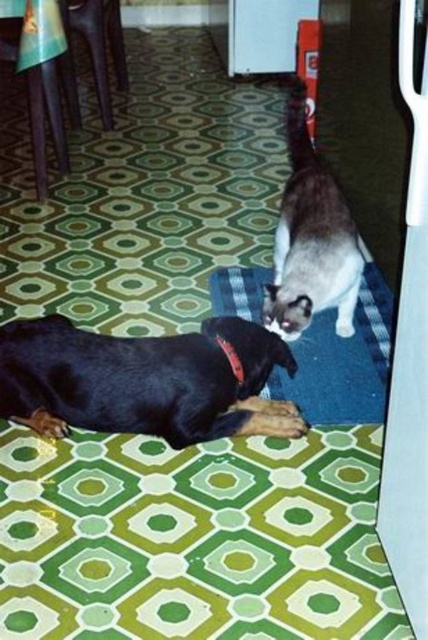
Question: Which point is farther to the camera?

Choices:
 (A) (193, 364)
 (B) (241, 371)
 (C) (327, 273)
 (D) (256, 268)

Answer: (D)

Question: Is black glossy dog at lower left smaller than white fur cat at upper center?

Choices:
 (A) yes
 (B) no

Answer: (A)

Question: Which of the following is the closest to the observer?

Choices:
 (A) black fabric neckband at lower center
 (B) blue carpet at center

Answer: (A)

Question: Considering the real-world distances, which object is farthest from the black glossy dog at lower left?

Choices:
 (A) black fabric neckband at lower center
 (B) blue carpet at center

Answer: (B)

Question: Does white fur cat at upper center appear over black fabric neckband at lower center?

Choices:
 (A) no
 (B) yes

Answer: (B)

Question: Does white fur cat at upper center have a greater width compared to blue carpet at center?

Choices:
 (A) no
 (B) yes

Answer: (A)